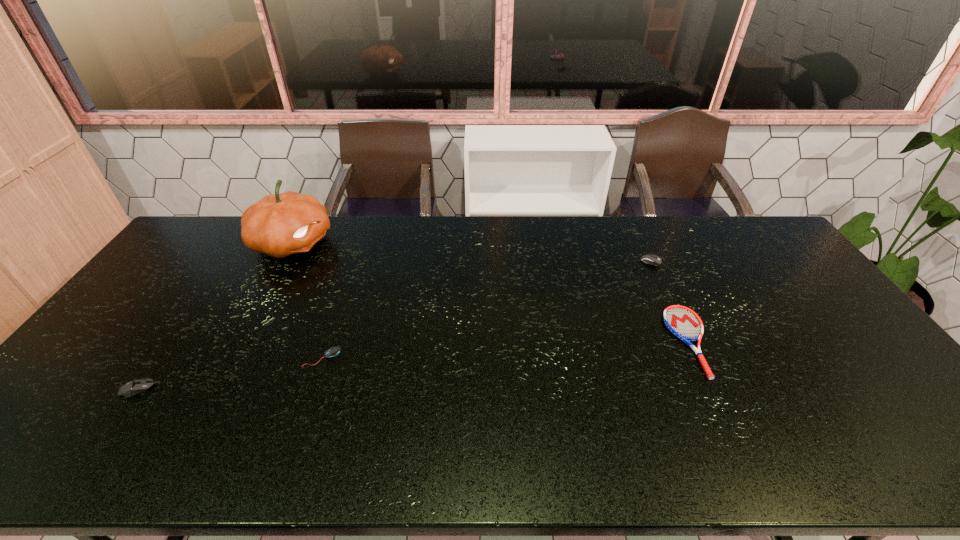
I want to click on vacant space at the near right corner of the desktop, so click(882, 433).

Find the location of a particular element. This screenshot has width=960, height=540. vacant point located between the third object from left to right and the tennis racket is located at coordinates (506, 349).

The height and width of the screenshot is (540, 960). Find the location of `unoccupied position between the second mouse from right to left and the pumpkin`. unoccupied position between the second mouse from right to left and the pumpkin is located at coordinates (307, 300).

Locate an element on the screen. The height and width of the screenshot is (540, 960). free space between the rightmost mouse and the leftmost mouse is located at coordinates tap(399, 324).

At what (x,y) coordinates should I click in order to perform the action: click on free space between the shortest mouse and the rightmost mouse. Please return your answer as a coordinate pair (x, y). Looking at the image, I should click on click(491, 308).

Image resolution: width=960 pixels, height=540 pixels. In order to click on free area in between the farthest mouse and the tennis racket in this screenshot , I will do `click(675, 300)`.

You are a GUI agent. You are given a task and a screenshot of the screen. Output one action in this format:
    pyautogui.click(x=<x>, y=<y>)
    Task: Click on the vacant space that's between the tennis racket and the leftmost mouse
    This screenshot has width=960, height=540.
    Given the screenshot: What is the action you would take?
    pyautogui.click(x=415, y=365)

At what (x,y) coordinates should I click in order to perform the action: click on vacant space that's between the leftmost mouse and the tennis racket. Please return your answer as a coordinate pair (x, y). The height and width of the screenshot is (540, 960). Looking at the image, I should click on (415, 365).

Locate an element on the screen. This screenshot has width=960, height=540. unoccupied position between the tennis racket and the nearest mouse is located at coordinates (415, 365).

At what (x,y) coordinates should I click in order to perform the action: click on free spot between the farthest mouse and the third object from right to left. Please return your answer as a coordinate pair (x, y). The height and width of the screenshot is (540, 960). Looking at the image, I should click on (491, 308).